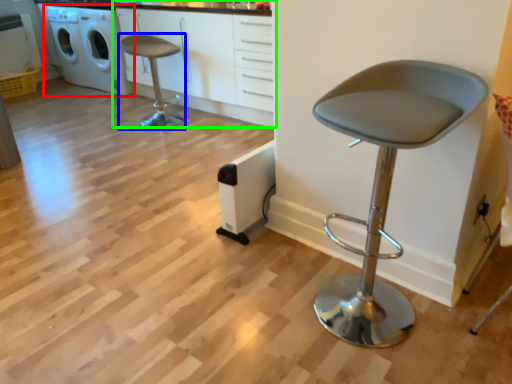
Question: Considering the real-world distances, which object is closest to washing machine (highlighted by a red box)? chair (highlighted by a blue box) or cabinetry (highlighted by a green box).

Choices:
 (A) chair
 (B) cabinetry

Answer: (B)